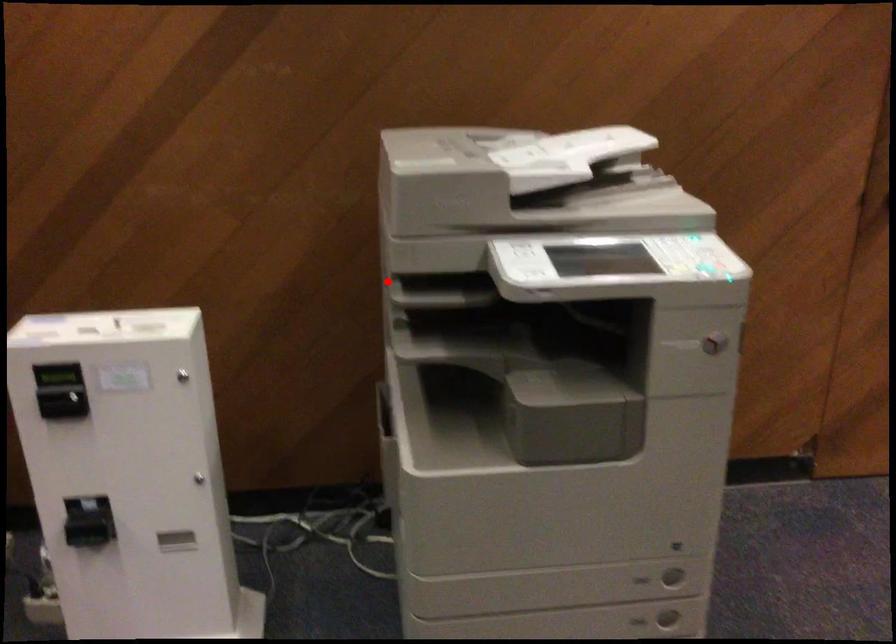
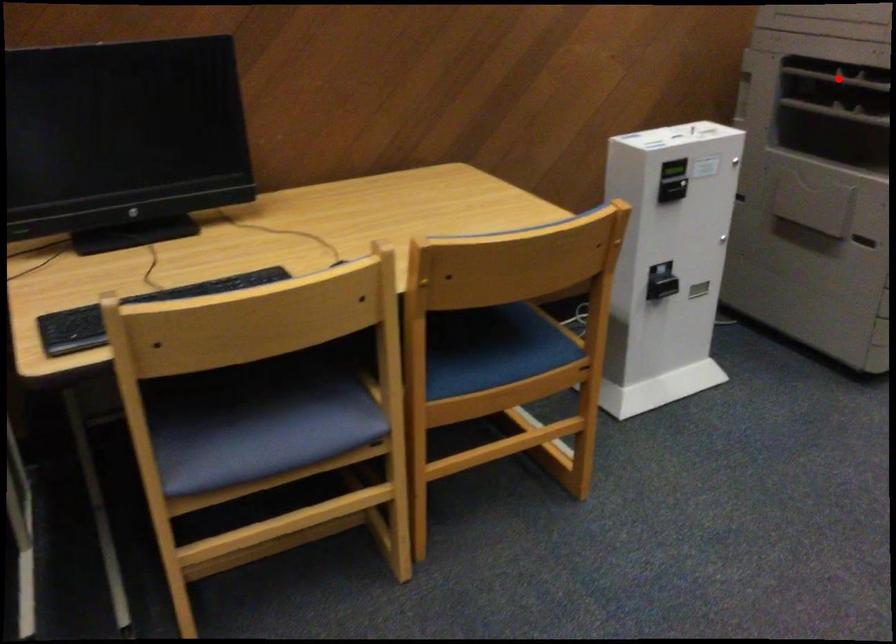
I am providing you with two images of the same scene from different viewpoints. A red point is marked on the first image and another point is marked on the second image. Does the point marked in image1 correspond to the same location as the one in image2?

Yes